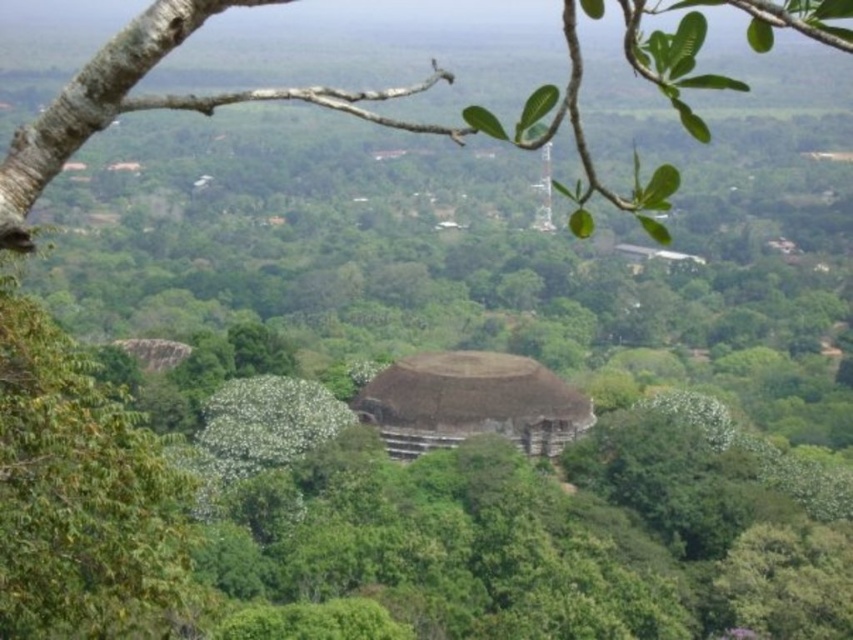
You are standing at the vantage point and want to take a photo of the traditional thatched roof structure in the midground without the green leafy branch at upper center obstructing the view. Based on their positions, can you position yourself such that the branch is out of the frame?

The green leafy branch at upper center is located at point (283, 99). Since it is at the upper center, you can position yourself slightly lower or shift your angle to the side to avoid the branch obstructing the view of the thatched roof structure in the midground.

You are standing at the highest point of the hill and looking at the scene. There is a point marked at coordinates point (283, 99). What is located at that point?

The point (283, 99) marks green leafy branch at upper center.